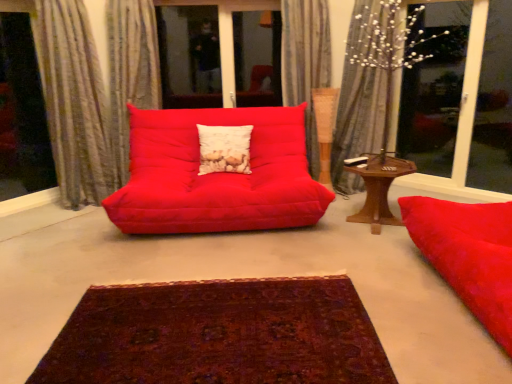
Find the location of a particular element. free space below wooden hexagonal table at right (from a real-world perspective) is located at coordinates (370, 221).